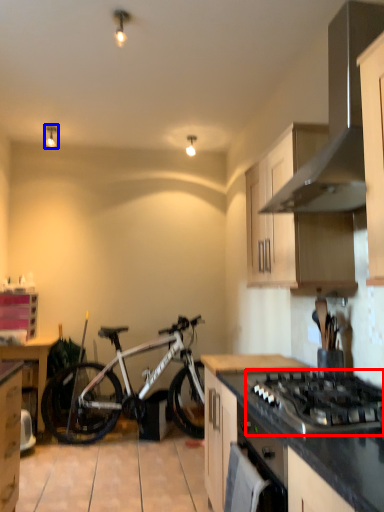
Question: Which object is closer to the camera taking this photo, gas stove (highlighted by a red box) or light fixture (highlighted by a blue box)?

Choices:
 (A) gas stove
 (B) light fixture

Answer: (A)